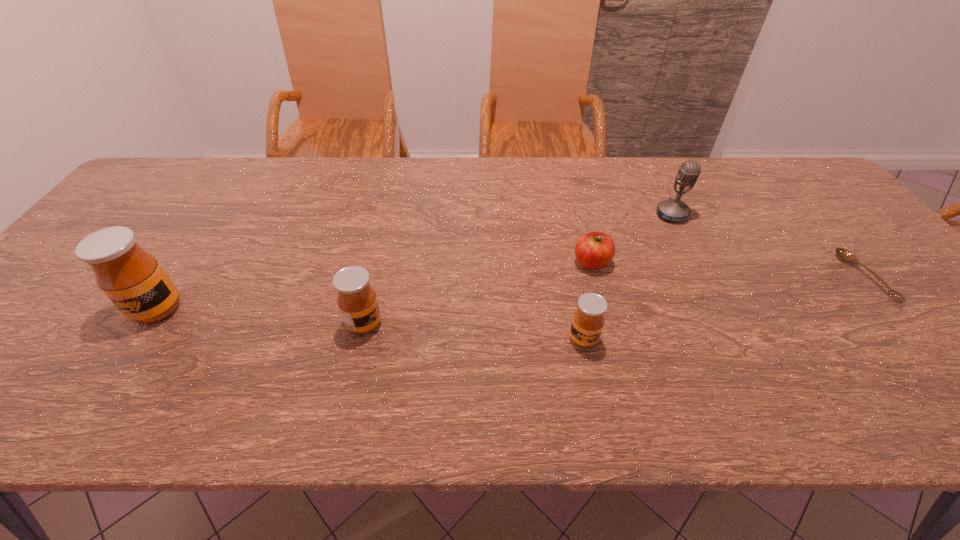
Where is `the tallest object`? the tallest object is located at coordinates (132, 278).

You are a GUI agent. You are given a task and a screenshot of the screen. Output one action in this format:
    pyautogui.click(x=<x>, y=<y>)
    Task: Click on the tallest honey
    The image size is (960, 540).
    Given the screenshot: What is the action you would take?
    point(132,278)

The image size is (960, 540). I want to click on the second honey from left to right, so click(357, 301).

The width and height of the screenshot is (960, 540). In order to click on the fifth object from right to left in this screenshot , I will do `click(357, 301)`.

Find the location of a particular element. This screenshot has width=960, height=540. the fourth tallest object is located at coordinates (588, 320).

Where is `the rightmost honey`? the rightmost honey is located at coordinates (588, 320).

The height and width of the screenshot is (540, 960). Identify the location of the shortest object. (845, 255).

Identify the location of the rightmost object. (845, 255).

In order to click on apple in this screenshot , I will do `click(594, 250)`.

Where is `microphone`? The width and height of the screenshot is (960, 540). microphone is located at coordinates (674, 210).